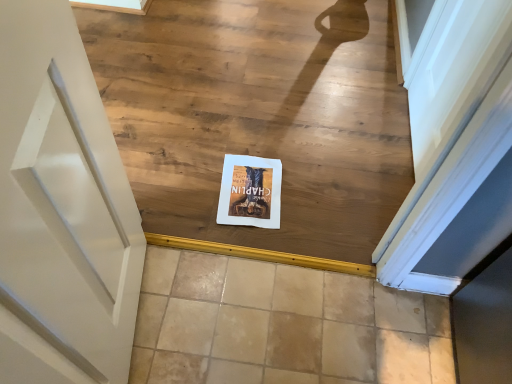
Question: From the image's perspective, is matte paper postcard at center positioned above or below beige tile at center?

Choices:
 (A) above
 (B) below

Answer: (A)

Question: Is matte paper postcard at center in front of or behind beige tile at center in the image?

Choices:
 (A) front
 (B) behind

Answer: (B)

Question: Based on their relative distances, which object is nearer to the white paper at center?

Choices:
 (A) matte paper postcard at center
 (B) beige tile at center

Answer: (A)

Question: Considering the real-world distances, which object is farthest from the beige tile at center?

Choices:
 (A) white paper at center
 (B) matte paper postcard at center

Answer: (A)